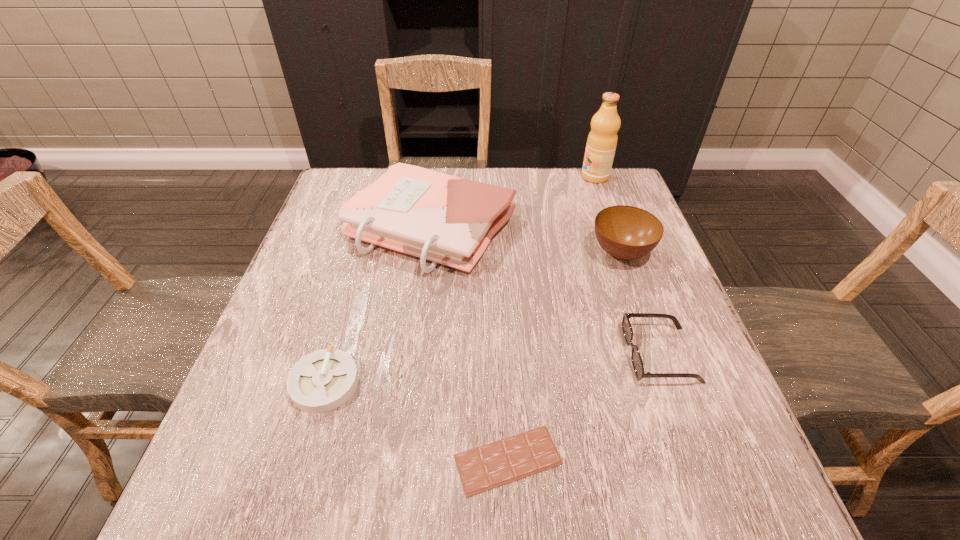
Find the location of a particular element. blank space at the left edge is located at coordinates (276, 402).

Where is `vacant space at the right edge of the desktop`? The image size is (960, 540). vacant space at the right edge of the desktop is located at coordinates (696, 404).

At what (x,y) coordinates should I click in order to perform the action: click on vacant space at the far left corner of the desktop. Please return your answer as a coordinate pair (x, y). Looking at the image, I should click on (324, 205).

Image resolution: width=960 pixels, height=540 pixels. Identify the location of vacant space in between the nearest object and the farthest object. (551, 318).

Locate an element on the screen. The image size is (960, 540). free point between the phonebook and the third shortest object is located at coordinates (545, 291).

You are a GUI agent. You are given a task and a screenshot of the screen. Output one action in this format:
    pyautogui.click(x=<x>, y=<y>)
    Task: Click on the free space between the fruit juice and the sunglasses
    This screenshot has height=540, width=960.
    Given the screenshot: What is the action you would take?
    pyautogui.click(x=628, y=266)

Where is `free space between the chocolate bar and the phonebook`? free space between the chocolate bar and the phonebook is located at coordinates (469, 343).

Image resolution: width=960 pixels, height=540 pixels. I want to click on vacant space in between the shortest object and the bowl, so click(564, 356).

Image resolution: width=960 pixels, height=540 pixels. Find the location of `free space between the chocolate bar and the ashtray`. free space between the chocolate bar and the ashtray is located at coordinates (417, 421).

The height and width of the screenshot is (540, 960). Identify the location of free point between the shortest object and the phonebook. (469, 343).